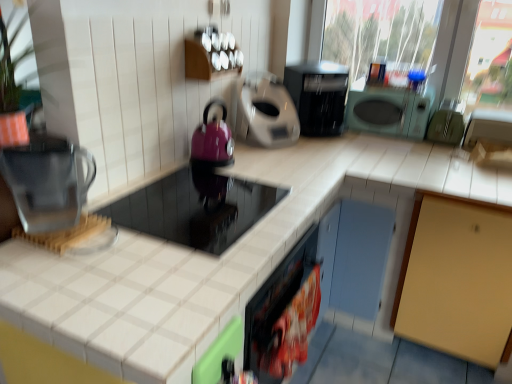
What is the approximate width of green matte microwave at upper right, which is the second appliance in right-to-left order?

11.97 inches.

I want to click on matte gray coffee maker at center, acting as the 3th appliance starting from the left, so click(265, 111).

How much space does matte gray coffee maker at center, the 4th appliance in the right-to-left sequence, occupy vertically?

matte gray coffee maker at center, the 4th appliance in the right-to-left sequence, is 13.46 inches in height.

Measure the distance between point [141,359] and camera.

A distance of 33.82 inches exists between point [141,359] and camera.

Measure the distance between point (332, 101) and camera.

Point (332, 101) and camera are 2.31 meters apart.

This screenshot has height=384, width=512. Find the location of `transparent plastic water filter at left`. transparent plastic water filter at left is located at coordinates (47, 182).

Is matte purple kettle at center-left, the 5th appliance from the right, smaller than green matte microwave at upper right, acting as the fifth appliance starting from the left?

Correct, matte purple kettle at center-left, the 5th appliance from the right, occupies less space than green matte microwave at upper right, acting as the fifth appliance starting from the left.

From the picture: Do you think matte purple kettle at center-left, acting as the second appliance starting from the left, is within green matte microwave at upper right, acting as the fifth appliance starting from the left, or outside of it?

The correct answer is: outside.

Is matte purple kettle at center-left, the 5th appliance from the right, further to camera compared to green matte microwave at upper right, acting as the fifth appliance starting from the left?

That is False.

Considering the sizes of objects matte purple kettle at center-left, acting as the second appliance starting from the left, and green matte microwave at upper right, which is the second appliance in right-to-left order, in the image provided, who is thinner, matte purple kettle at center-left, acting as the second appliance starting from the left, or green matte microwave at upper right, which is the second appliance in right-to-left order,?

matte purple kettle at center-left, acting as the second appliance starting from the left.

Is matte gray coffee maker at center, acting as the 3th appliance starting from the left, bigger than transparent plastic water filter at left?

Indeed, matte gray coffee maker at center, acting as the 3th appliance starting from the left, has a larger size compared to transparent plastic water filter at left.

Can you confirm if matte gray coffee maker at center, the 4th appliance in the right-to-left sequence, is taller than transparent plastic water filter at left?

Correct, matte gray coffee maker at center, the 4th appliance in the right-to-left sequence, is much taller as transparent plastic water filter at left.

From the image's perspective, is transparent plastic water filter at left over green matte microwave at upper right, acting as the fifth appliance starting from the left?

No, from the image's perspective, transparent plastic water filter at left is not on top of green matte microwave at upper right, acting as the fifth appliance starting from the left.

Considering the relative sizes of transparent plastic water filter at left and green matte microwave at upper right, which is the second appliance in right-to-left order, in the image provided, is transparent plastic water filter at left bigger than green matte microwave at upper right, which is the second appliance in right-to-left order,?

Actually, transparent plastic water filter at left might be smaller than green matte microwave at upper right, which is the second appliance in right-to-left order.

Considering the sizes of objects transparent plastic water filter at left and green matte microwave at upper right, which is the second appliance in right-to-left order, in the image provided, who is thinner, transparent plastic water filter at left or green matte microwave at upper right, which is the second appliance in right-to-left order,?

Thinner between the two is transparent plastic water filter at left.

From the picture: Relative to green matte microwave at upper right, acting as the fifth appliance starting from the left, is transparent plastic water filter at left in front or behind?

Visually, transparent plastic water filter at left is located in front of green matte microwave at upper right, acting as the fifth appliance starting from the left.

Who is smaller, shiny black cooktop at center, the first appliance from the left, or green matte microwave at upper right, which is the second appliance in right-to-left order?

green matte microwave at upper right, which is the second appliance in right-to-left order.

Between shiny black cooktop at center, the first appliance from the left, and green matte microwave at upper right, acting as the fifth appliance starting from the left, which one has less height?

shiny black cooktop at center, the first appliance from the left.

Which point is more forward, (226, 213) or (372, 132)?

The point (226, 213) is closer to the camera.

Based on the photo, do you think shiny black cooktop at center, the first appliance from the left, is within green matte microwave at upper right, which is the second appliance in right-to-left order, or outside of it?

shiny black cooktop at center, the first appliance from the left, is not inside green matte microwave at upper right, which is the second appliance in right-to-left order, it's outside.

Is matte gray coffee maker at center, the 4th appliance in the right-to-left sequence, oriented towards shiny black cooktop at center, marked as the sixth appliance in a right-to-left arrangement?

No, matte gray coffee maker at center, the 4th appliance in the right-to-left sequence, does not turn towards shiny black cooktop at center, marked as the sixth appliance in a right-to-left arrangement.

Which of these two, matte gray coffee maker at center, acting as the 3th appliance starting from the left, or shiny black cooktop at center, the first appliance from the left, is smaller?

Smaller between the two is matte gray coffee maker at center, acting as the 3th appliance starting from the left.

Choose the correct answer: Is matte gray coffee maker at center, acting as the 3th appliance starting from the left, inside shiny black cooktop at center, the first appliance from the left, or outside it?

matte gray coffee maker at center, acting as the 3th appliance starting from the left, is not enclosed by shiny black cooktop at center, the first appliance from the left.

Is point (253, 242) positioned before point (291, 295)?

Yes, point (253, 242) is closer to viewer.

Is plastic bag of chips at lower center, which is counted as the 3th appliance, starting from the right, surrounded by white tile countertop at center?

Definitely not — plastic bag of chips at lower center, which is counted as the 3th appliance, starting from the right, is not inside white tile countertop at center.

From a real-world perspective, which object rests below the other?

white tile countertop at center is physically lower.

Based on their positions, is white tile countertop at center located to the left or right of plastic bag of chips at lower center, marked as the 4th appliance in a left-to-right arrangement?

From the image, it's evident that white tile countertop at center is to the left of plastic bag of chips at lower center, marked as the 4th appliance in a left-to-right arrangement.

Considering the sizes of matte gray coffee maker at center, acting as the 3th appliance starting from the left, and green matte microwave at upper right, which is the second appliance in right-to-left order, in the image, is matte gray coffee maker at center, acting as the 3th appliance starting from the left, bigger or smaller than green matte microwave at upper right, which is the second appliance in right-to-left order,?

In the image, matte gray coffee maker at center, acting as the 3th appliance starting from the left, appears to be larger than green matte microwave at upper right, which is the second appliance in right-to-left order.

Is green matte microwave at upper right, acting as the fifth appliance starting from the left, completely or partially inside matte gray coffee maker at center, the 4th appliance in the right-to-left sequence?

No, matte gray coffee maker at center, the 4th appliance in the right-to-left sequence, does not contain green matte microwave at upper right, acting as the fifth appliance starting from the left.

Considering the sizes of objects matte gray coffee maker at center, the 4th appliance in the right-to-left sequence, and green matte microwave at upper right, which is the second appliance in right-to-left order, in the image provided, who is taller, matte gray coffee maker at center, the 4th appliance in the right-to-left sequence, or green matte microwave at upper right, which is the second appliance in right-to-left order,?

matte gray coffee maker at center, the 4th appliance in the right-to-left sequence, is taller.

Would you say matte gray coffee maker at center, acting as the 3th appliance starting from the left, is a long distance from green matte microwave at upper right, acting as the fifth appliance starting from the left?

No, matte gray coffee maker at center, acting as the 3th appliance starting from the left, is in close proximity to green matte microwave at upper right, acting as the fifth appliance starting from the left.

Where is `appliance that is the 3rd one when counting backward from the matte purple kettle at center-left, the 5th appliance from the right`? Image resolution: width=512 pixels, height=384 pixels. appliance that is the 3rd one when counting backward from the matte purple kettle at center-left, the 5th appliance from the right is located at coordinates (389, 111).

You are a GUI agent. You are given a task and a screenshot of the screen. Output one action in this format:
    pyautogui.click(x=<x>, y=<y>)
    Task: Click on the kitchen appliance below the matte gray coffee maker at center, the 4th appliance in the right-to-left sequence (from a real-world perspective)
    This screenshot has width=512, height=384.
    Given the screenshot: What is the action you would take?
    pyautogui.click(x=47, y=182)

Based on their spatial positions, is plastic bag of chips at lower center, which is counted as the 3th appliance, starting from the right, or shiny black cooktop at center, marked as the sixth appliance in a right-to-left arrangement, closer to green rubber gloves at right, acting as the sixth appliance starting from the left?

Among the two, plastic bag of chips at lower center, which is counted as the 3th appliance, starting from the right, is located nearer to green rubber gloves at right, acting as the sixth appliance starting from the left.

From the picture: Looking at the image, which one is located further to green rubber gloves at right, acting as the sixth appliance starting from the left, matte gray coffee maker at center, the 4th appliance in the right-to-left sequence, or matte purple kettle at center-left, acting as the second appliance starting from the left?

Based on the image, matte purple kettle at center-left, acting as the second appliance starting from the left, appears to be further to green rubber gloves at right, acting as the sixth appliance starting from the left.

Based on their spatial positions, is shiny black cooktop at center, marked as the sixth appliance in a right-to-left arrangement, or matte gray coffee maker at center, the 4th appliance in the right-to-left sequence, further from white tile countertop at center?

matte gray coffee maker at center, the 4th appliance in the right-to-left sequence, is positioned further to the anchor white tile countertop at center.

Based on their spatial positions, is plastic bag of chips at lower center, marked as the 4th appliance in a left-to-right arrangement, or green rubber gloves at right, marked as the first appliance in a right-to-left arrangement, closer to white tile countertop at center?

plastic bag of chips at lower center, marked as the 4th appliance in a left-to-right arrangement.

When comparing their distances from plastic bag of chips at lower center, marked as the 4th appliance in a left-to-right arrangement, does green rubber gloves at right, acting as the sixth appliance starting from the left, or transparent plastic water filter at left seem closer?

Among the two, transparent plastic water filter at left is located nearer to plastic bag of chips at lower center, marked as the 4th appliance in a left-to-right arrangement.

Based on their spatial positions, is green rubber gloves at right, marked as the first appliance in a right-to-left arrangement, or matte gray coffee maker at center, acting as the 3th appliance starting from the left, further from matte purple kettle at center-left, acting as the second appliance starting from the left?

The object further to matte purple kettle at center-left, acting as the second appliance starting from the left, is green rubber gloves at right, marked as the first appliance in a right-to-left arrangement.

Considering their positions, is plastic bag of chips at lower center, which is counted as the 3th appliance, starting from the right, positioned closer to black plastic toaster at upper center than green matte microwave at upper right, acting as the fifth appliance starting from the left?

green matte microwave at upper right, acting as the fifth appliance starting from the left, is closer to black plastic toaster at upper center.

Estimate the real-world distances between objects in this image. Which object is further from green rubber gloves at right, acting as the sixth appliance starting from the left, black plastic toaster at upper center or plastic bag of chips at lower center, which is counted as the 3th appliance, starting from the right?

plastic bag of chips at lower center, which is counted as the 3th appliance, starting from the right, lies further to green rubber gloves at right, acting as the sixth appliance starting from the left, than the other object.

This screenshot has height=384, width=512. What are the coordinates of `kitchen appliance between white tile countertop at center and black plastic toaster at upper center along the z-axis` in the screenshot? It's located at (47, 182).

I want to click on home appliance located between shiny black cooktop at center, marked as the sixth appliance in a right-to-left arrangement, and green matte microwave at upper right, acting as the fifth appliance starting from the left, in the depth direction, so click(x=318, y=96).

The image size is (512, 384). Find the location of `kitchen appliance between matte gray coffee maker at center, the 4th appliance in the right-to-left sequence, and plastic bag of chips at lower center, which is counted as the 3th appliance, starting from the right, from top to bottom`. kitchen appliance between matte gray coffee maker at center, the 4th appliance in the right-to-left sequence, and plastic bag of chips at lower center, which is counted as the 3th appliance, starting from the right, from top to bottom is located at coordinates (47, 182).

Identify the location of countertop between transparent plastic water filter at left and plastic bag of chips at lower center, which is counted as the 3th appliance, starting from the right, from left to right. The image size is (512, 384). (215, 258).